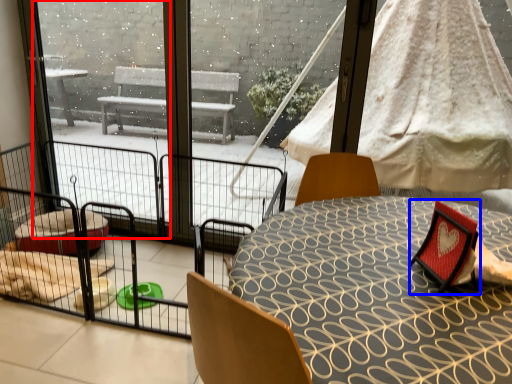
Question: Which point is closer to the camera, window screen (highlighted by a red box) or armchair (highlighted by a blue box)?

Choices:
 (A) window screen
 (B) armchair

Answer: (B)